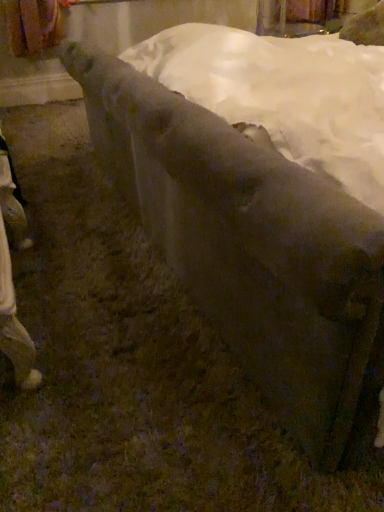
What is the approximate height of smooth stone bench at center?

It is 32.78 inches.

What is the approximate width of smooth stone bench at center?

smooth stone bench at center is 7.08 feet wide.

Describe the element at coordinates (249, 244) in the screenshot. I see `smooth stone bench at center` at that location.

Identify the location of smooth stone bench at center. (249, 244).

Find the location of a particular element. smooth stone bench at center is located at coordinates (249, 244).